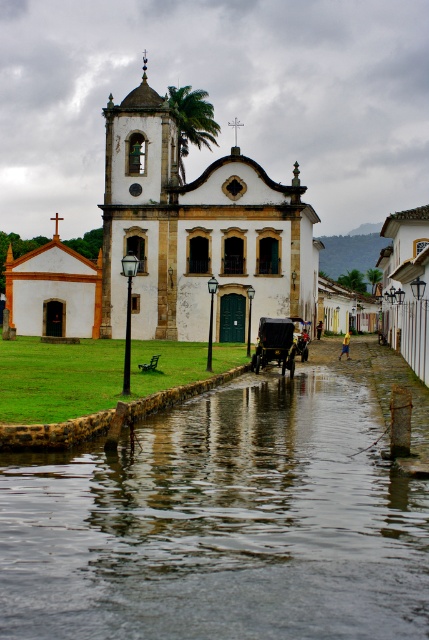
Question: Which is nearer to the clear water at lower center?

Choices:
 (A) green leafy palm tree at upper center
 (B) green leafy palm tree at center
 (C) white stucco church at center

Answer: (C)

Question: From the image, what is the correct spatial relationship of clear water at lower center in relation to shiny black cart at center?

Choices:
 (A) above
 (B) below

Answer: (B)

Question: Which point appears closest to the camera in this image?

Choices:
 (A) (259, 340)
 (B) (369, 276)

Answer: (A)

Question: Considering the real-world distances, which object is farthest from the clear water at lower center?

Choices:
 (A) green leafy palm tree at upper center
 (B) white stucco church at center
 (C) shiny black cart at center
 (D) green leafy palm tree at center

Answer: (D)

Question: Is clear water at lower center below shiny black cart at center?

Choices:
 (A) no
 (B) yes

Answer: (B)

Question: Can you confirm if green leafy palm tree at upper center is smaller than shiny black cart at center?

Choices:
 (A) yes
 (B) no

Answer: (B)